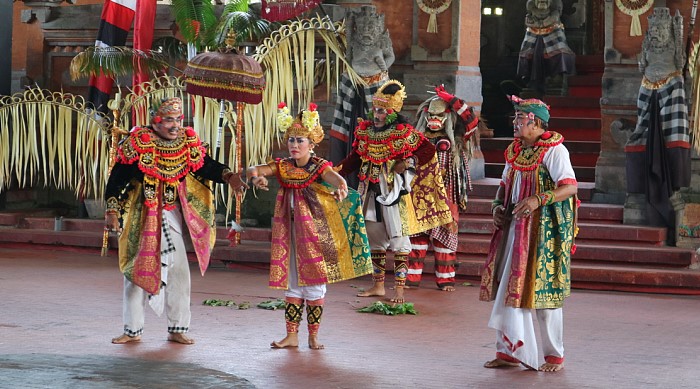
Where is `statue`? This screenshot has height=389, width=700. statue is located at coordinates (664, 38), (360, 36).